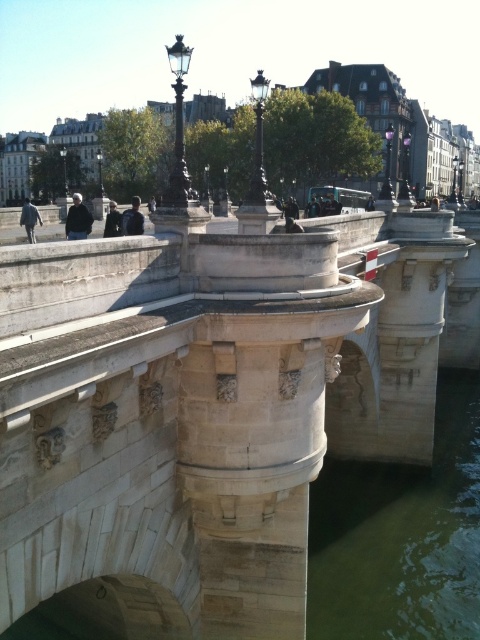
You are a tourist standing on the sidewalk and want to take a photo of the beige stone bridge at center and the green stone water at lower right. Which object should you focus on first if you want to capture both in a single frame without moving your camera?

The beige stone bridge at center has a larger size compared to green stone water at lower right, so you should focus on the beige stone bridge at center first to ensure it fills the frame adequately while still capturing the smaller green stone water at lower right in the background.

Consider the image. You are a tourist standing on the beige stone bridge at center. You want to take a photo of the green stone water at lower right. Which direction should you look to capture it in your photo?

The beige stone bridge at center is located above the green stone water at lower right, so you should look downward to capture the green stone water at lower right in your photo.